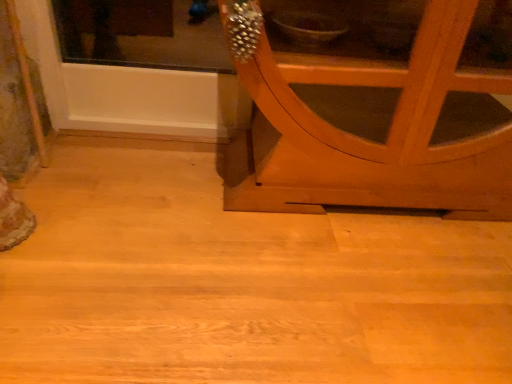
Describe the element at coordinates (367, 140) in the screenshot. This screenshot has width=512, height=384. I see `wooden cabinet at right` at that location.

Find the location of a particular element. The width and height of the screenshot is (512, 384). wooden cabinet at right is located at coordinates (367, 140).

You are a GUI agent. You are given a task and a screenshot of the screen. Output one action in this format:
    pyautogui.click(x=<x>, y=<y>)
    Task: Click on the wooden cabinet at right
    
    Given the screenshot: What is the action you would take?
    pyautogui.click(x=367, y=140)